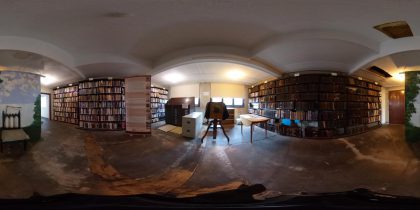
Identify the location of ceiling light. The width and height of the screenshot is (420, 210). (236, 76), (174, 78), (48, 79), (402, 78).